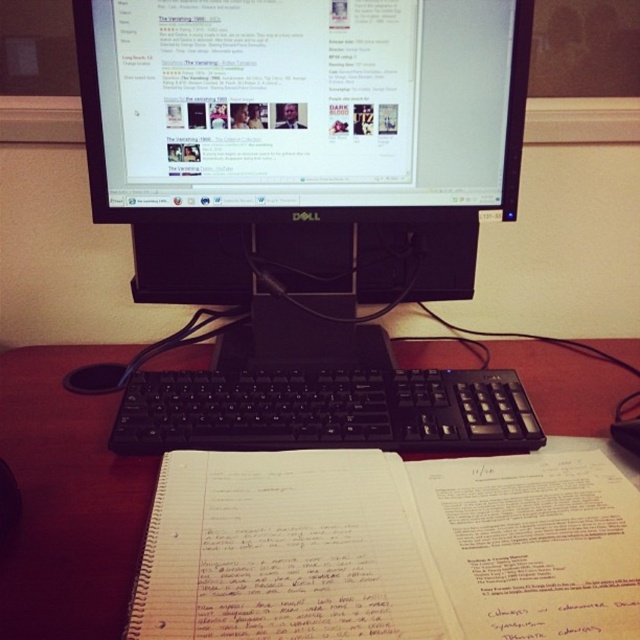
You are organizing your desk and want to place a new pen holder. You have two items on your desk, the wooden at center and the black plastic mouse at lower left. Which item is located closer to the edge of the desk?

The black plastic mouse at lower left is closer to the edge of the desk because it is positioned above the wooden at center, which is under it.

You are setting up a new Dell computer monitor on your desk. You have a black matte monitor at upper center and a wooden at center. Which object is located above the other?

The black matte monitor at upper center is positioned over the wooden at center, so it is above the wooden at center.